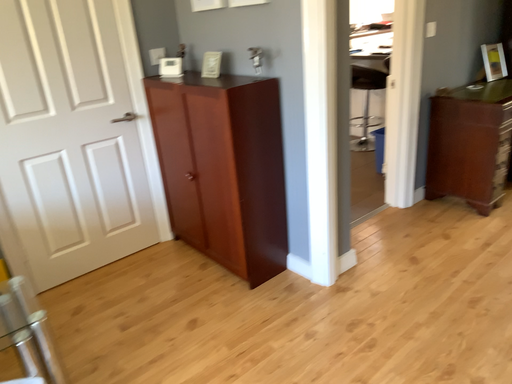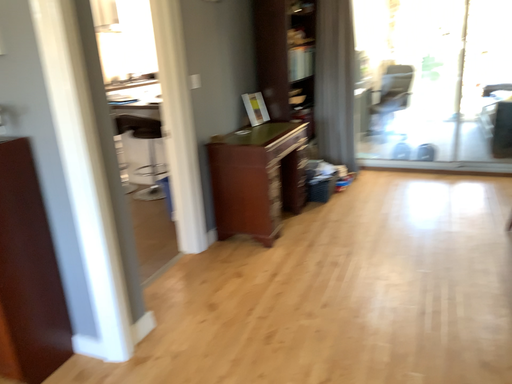
Question: Which way did the camera rotate in the video?

Choices:
 (A) rotated downward
 (B) rotated upward

Answer: (B)